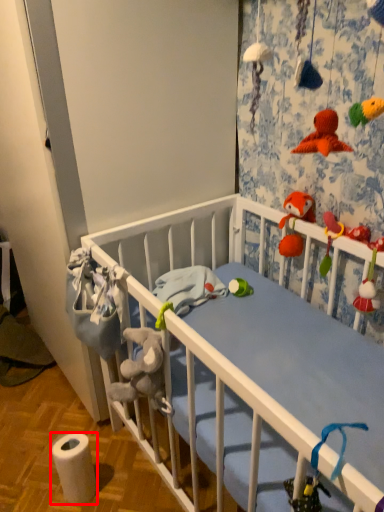
Question: From the image's perspective, what is the correct spatial relationship of toilet paper (annotated by the red box) in relation to toy?

Choices:
 (A) above
 (B) below

Answer: (B)